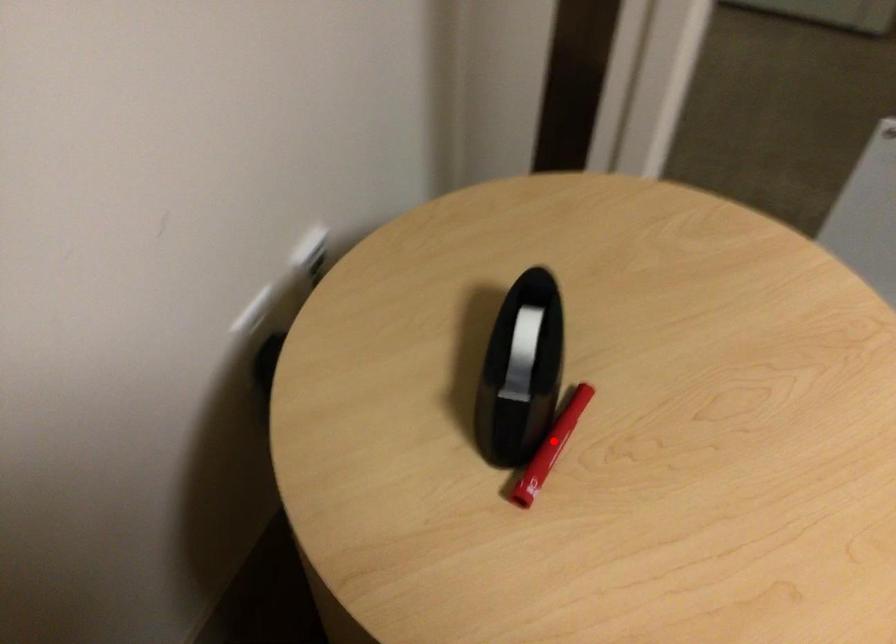
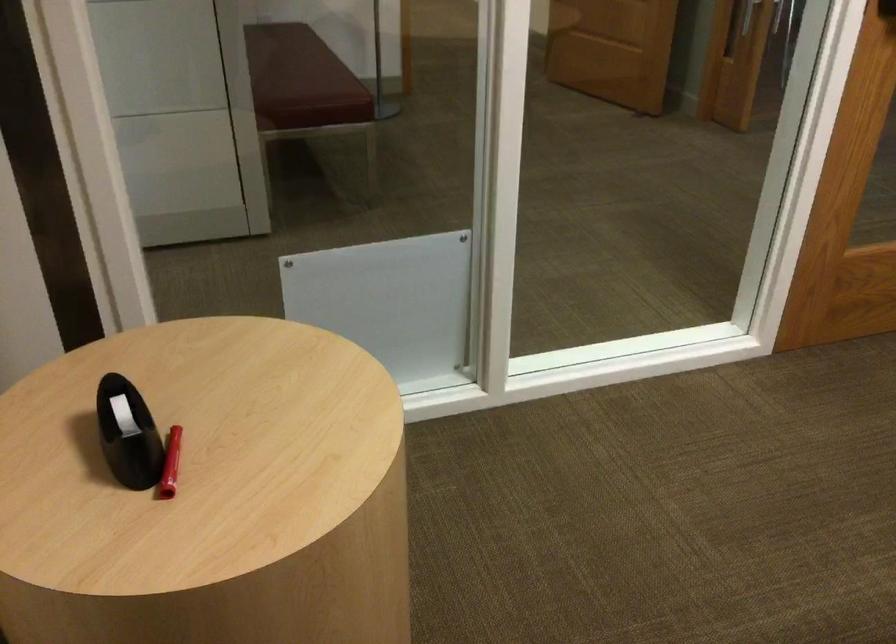
The point at the highlighted location is marked in the first image. Where is the corresponding point in the second image?

(170, 464)